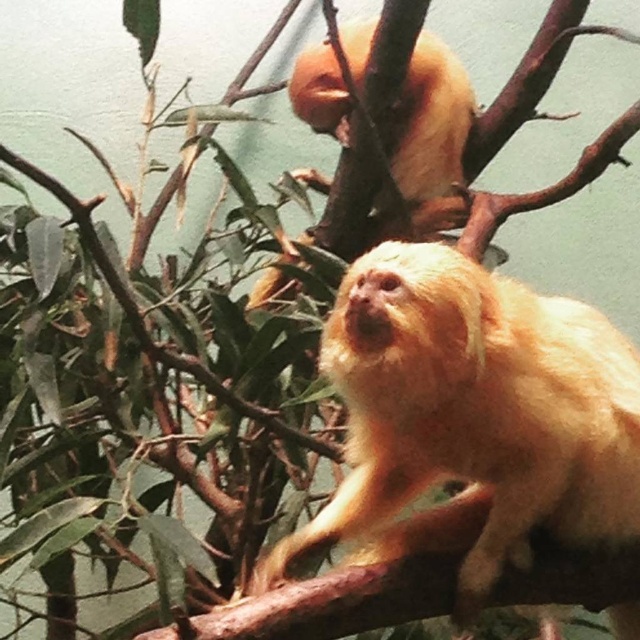
From the picture: Between golden fur monkey at center and golden fur monkey at upper center, which one is positioned higher?

golden fur monkey at upper center

Which is behind, point (388, 332) or point (456, 212)?

Point (456, 212)

Where is `golden fur monkey at center`? golden fur monkey at center is located at coordinates (476, 408).